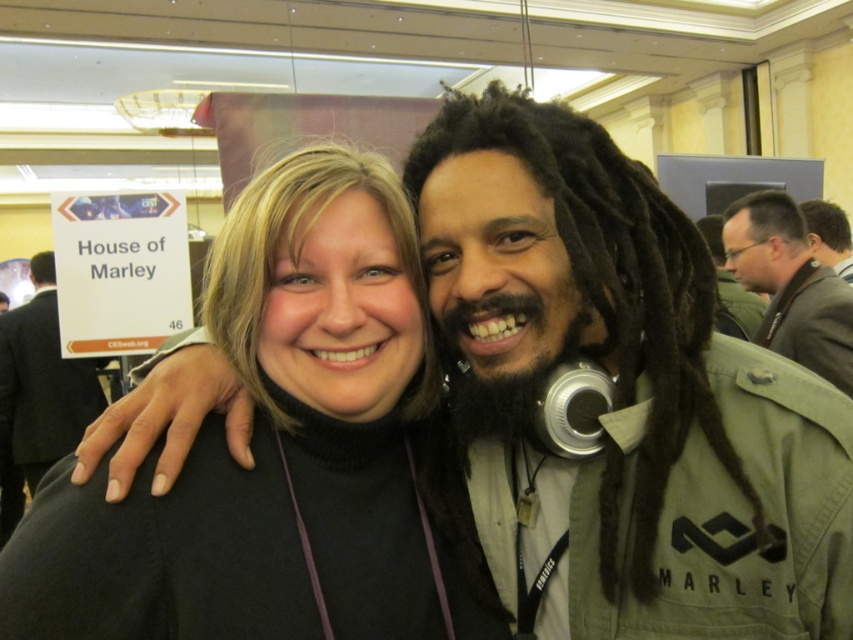
Is dark green fabric jacket at center in front of dark brown hair at upper right?

No, it is not.

Which is behind, point (26, 352) or point (819, 250)?

Positioned behind is point (26, 352).

At what (x,y) coordinates should I click in order to perform the action: click on dark green fabric jacket at center. Please return your answer as a coordinate pair (x, y). Looking at the image, I should click on (44, 380).

Does black turtleneck sweater at center come in front of brown leather jacket at upper right?

Yes, black turtleneck sweater at center is closer to the viewer.

How much distance is there between black turtleneck sweater at center and brown leather jacket at upper right?

black turtleneck sweater at center and brown leather jacket at upper right are 5.29 feet apart.

This screenshot has width=853, height=640. I want to click on black turtleneck sweater at center, so click(274, 449).

This screenshot has height=640, width=853. I want to click on black turtleneck sweater at center, so click(x=274, y=449).

Who is taller, black turtleneck sweater at center or dark green fabric jacket at center?

dark green fabric jacket at center is taller.

Can you confirm if black turtleneck sweater at center is smaller than dark green fabric jacket at center?

Yes, black turtleneck sweater at center is smaller than dark green fabric jacket at center.

Describe the element at coordinates (274, 449) in the screenshot. This screenshot has height=640, width=853. I see `black turtleneck sweater at center` at that location.

Where is `black turtleneck sweater at center`? The width and height of the screenshot is (853, 640). black turtleneck sweater at center is located at coordinates (x=274, y=449).